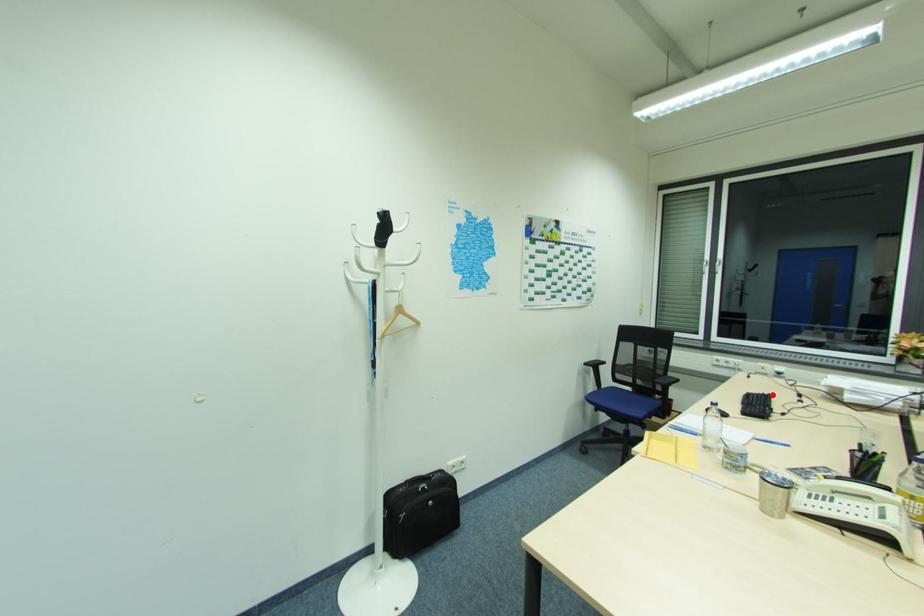
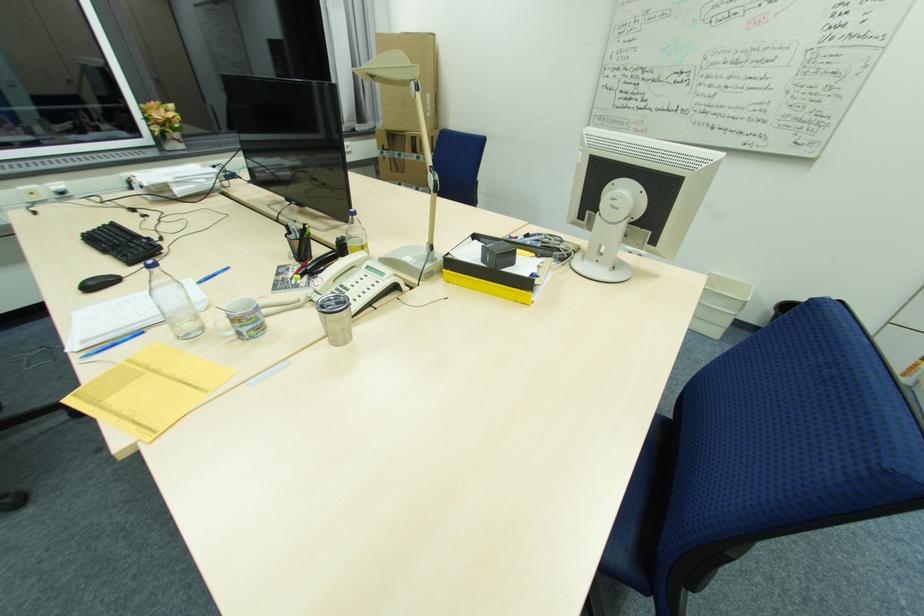
Find the pixel in the second image that matches the highlighted location in the first image.

(116, 224)